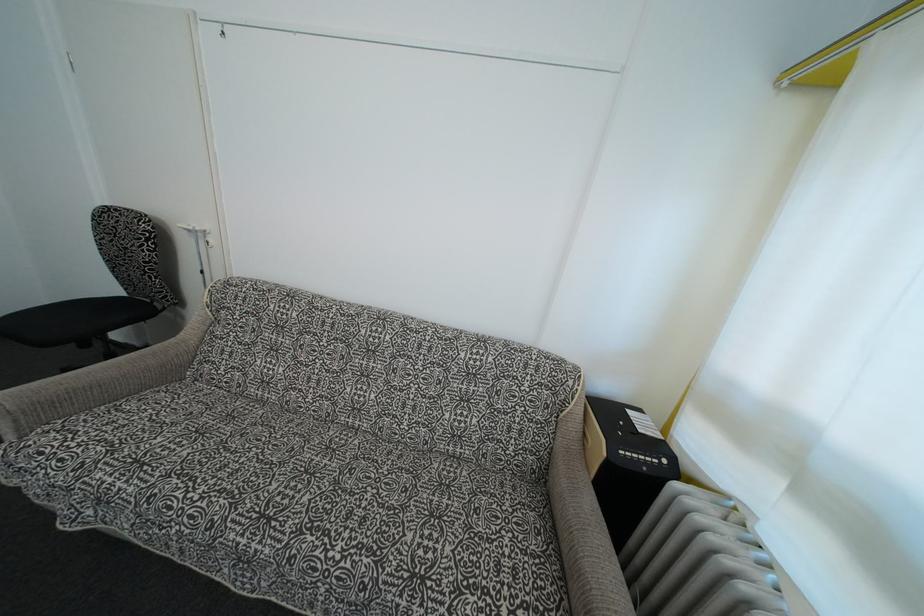
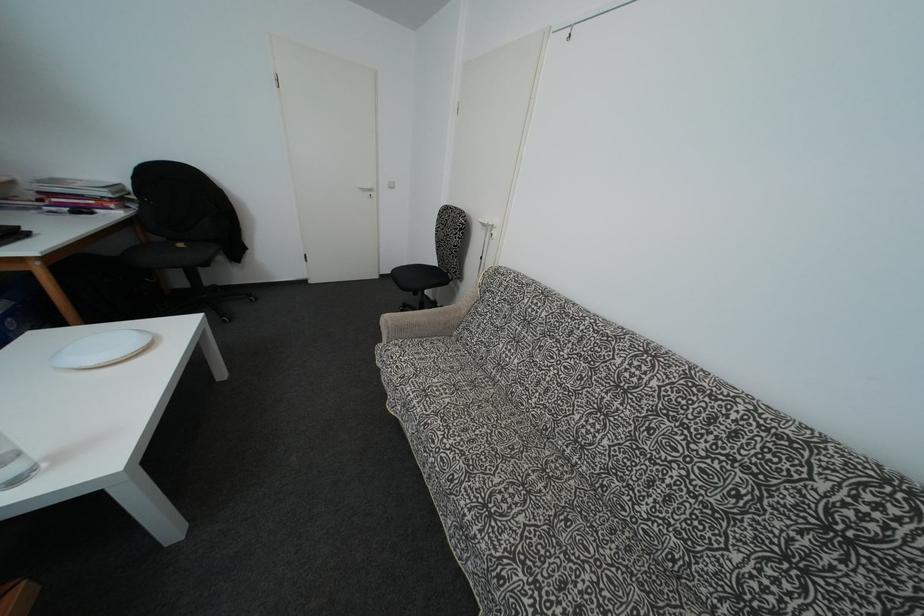
Question: Based on the continuous images, in which direction is the camera rotating? Reply with the corresponding letter.

Choices:
 (A) Left
 (B) Right
 (C) Up
 (D) Down

Answer: (A)